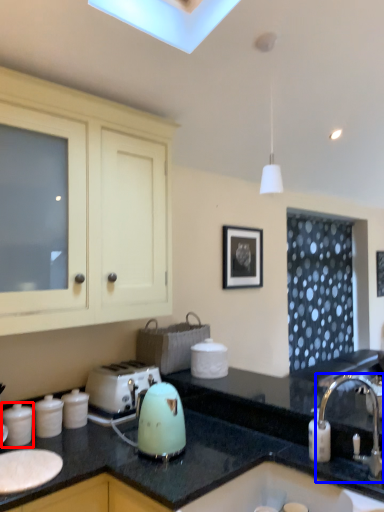
Question: Which object is further to the camera taking this photo, kitchen appliance (highlighted by a red box) or tap (highlighted by a blue box)?

Choices:
 (A) kitchen appliance
 (B) tap

Answer: (A)